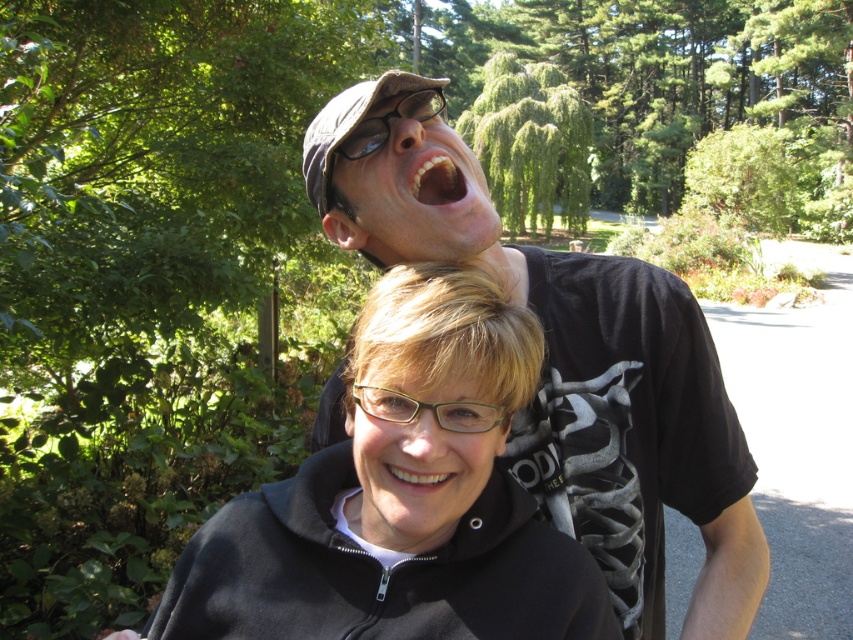
Question: Which of these objects is positioned farthest from the white glossy teeth at upper center?

Choices:
 (A) black matte t-shirt at upper center
 (B) white glossy teeth at center

Answer: (B)

Question: Which point appears farthest from the camera in this image?

Choices:
 (A) (451, 196)
 (B) (376, 416)
 (C) (405, 227)
 (D) (370, 481)

Answer: (A)

Question: Does white glossy teeth at upper center appear over white glossy teeth at center?

Choices:
 (A) no
 (B) yes

Answer: (B)

Question: Does black matte t-shirt at upper center appear on the right side of white glossy teeth at center?

Choices:
 (A) no
 (B) yes

Answer: (B)

Question: Can you confirm if white glossy teeth at upper center is smaller than white glossy teeth at center?

Choices:
 (A) no
 (B) yes

Answer: (A)

Question: Among these points, which one is nearest to the camera?

Choices:
 (A) (463, 474)
 (B) (409, 323)
 (C) (645, 579)

Answer: (B)